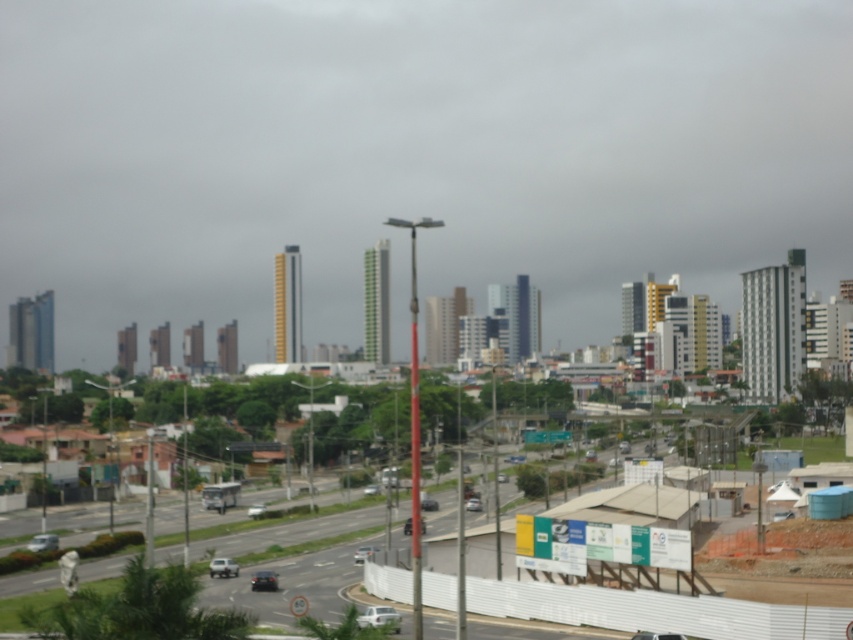
Question: Is white plastic fence at lower center thinner than silver metallic sedan at center?

Choices:
 (A) yes
 (B) no

Answer: (B)

Question: Can you confirm if white matte car at center is thinner than shiny black sedan at center?

Choices:
 (A) no
 (B) yes

Answer: (A)

Question: Does white plastic fence at lower center come behind matte silver car at lower left?

Choices:
 (A) no
 (B) yes

Answer: (A)

Question: Which point is closer to the camera taking this photo?

Choices:
 (A) (30, 545)
 (B) (428, 509)
 (C) (370, 554)
 (D) (363, 624)

Answer: (D)

Question: Which object is closer to the camera taking this photo?

Choices:
 (A) shiny black car at center
 (B) white matte car at center
 (C) silver metallic car at lower left

Answer: (A)

Question: Which object appears farthest from the camera in this image?

Choices:
 (A) silver metallic car at lower left
 (B) shiny black sedan at center
 (C) white matte car at lower center

Answer: (B)